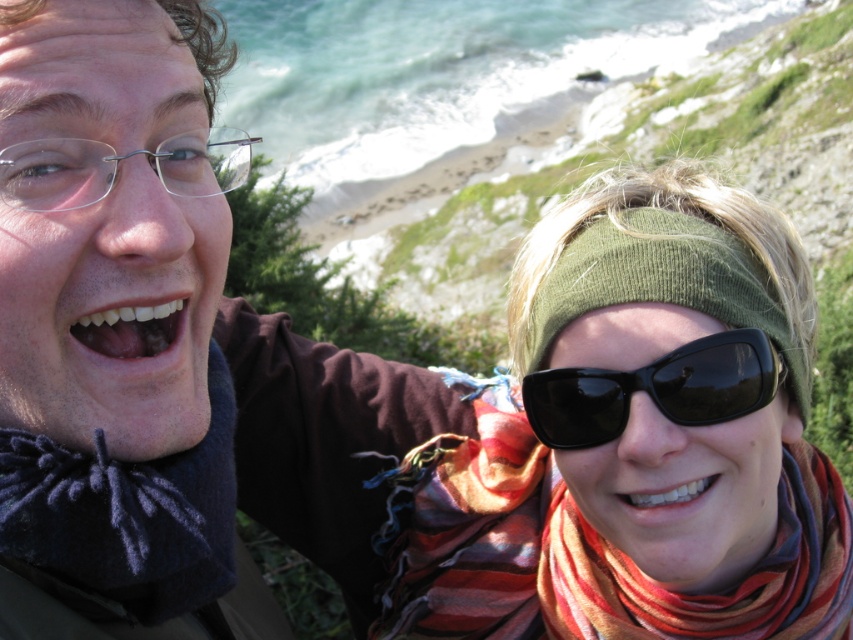
Question: Considering the real-world distances, which object is farthest from the dark blue felt scarf at lower left?

Choices:
 (A) white glossy teeth at lower right
 (B) white glossy teeth at center

Answer: (A)

Question: Which object is closer to the camera taking this photo?

Choices:
 (A) white glossy teeth at lower right
 (B) striped wool scarf at center
 (C) clear plastic glasses at upper left
 (D) white glossy teeth at center

Answer: (C)

Question: Observing the image, what is the correct spatial positioning of clear plastic glasses at upper left in reference to white glossy teeth at center?

Choices:
 (A) above
 (B) below

Answer: (A)

Question: Is clear plastic glasses at upper left positioned in front of white glossy teeth at lower right?

Choices:
 (A) no
 (B) yes

Answer: (B)

Question: Is clear plastic glasses at upper left in front of white glossy teeth at lower right?

Choices:
 (A) yes
 (B) no

Answer: (A)

Question: Which is farther from the white glossy teeth at lower right?

Choices:
 (A) dark blue felt scarf at lower left
 (B) white glossy teeth at center
 (C) striped wool scarf at center
 (D) clear plastic glasses at upper left

Answer: (B)